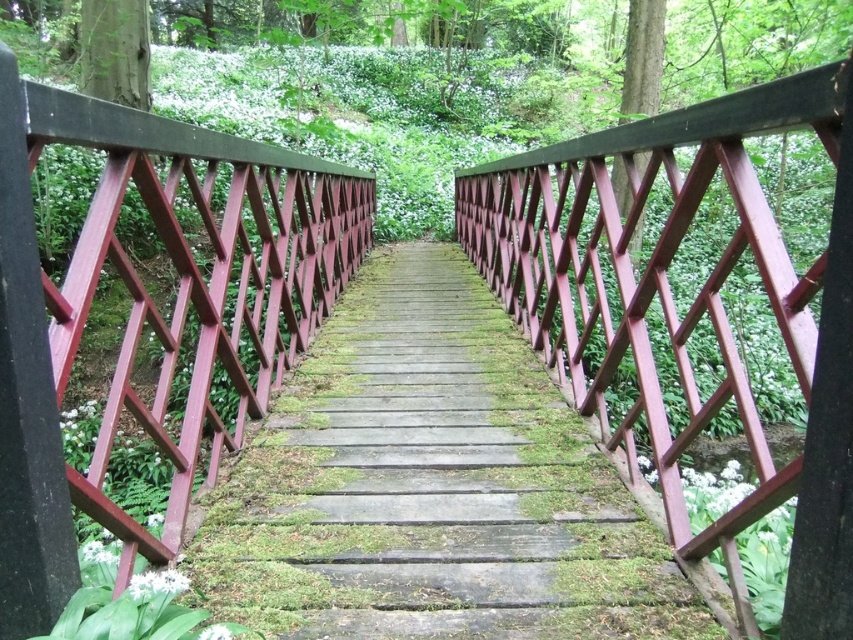
Question: Which point is farther from the camera taking this photo?

Choices:
 (A) (532, 484)
 (B) (753, 492)
 (C) (256, 292)

Answer: (C)

Question: Which object is the closest to the wooden stairs at center?

Choices:
 (A) smooth red wooden balustrade at center
 (B) matte red wooden rail at upper center

Answer: (A)

Question: Can you confirm if matte red wooden rail at upper center is positioned above smooth red wooden balustrade at center?

Choices:
 (A) yes
 (B) no

Answer: (B)

Question: Can you confirm if wooden stairs at center is bigger than matte red wooden rail at upper center?

Choices:
 (A) no
 (B) yes

Answer: (A)

Question: Can you confirm if wooden stairs at center is smaller than matte red wooden rail at upper center?

Choices:
 (A) yes
 (B) no

Answer: (A)

Question: Which object is positioned farthest from the smooth red wooden balustrade at center?

Choices:
 (A) wooden stairs at center
 (B) matte red wooden rail at upper center

Answer: (B)